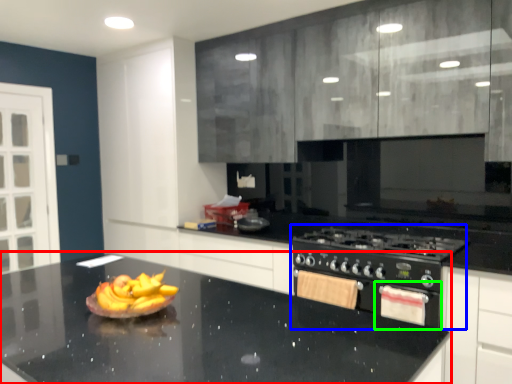
Question: Which object is positioned farthest from countertop (highlighted by a red box)? Select from appliance (highlighted by a blue box) and oven (highlighted by a green box).

Choices:
 (A) appliance
 (B) oven

Answer: (B)